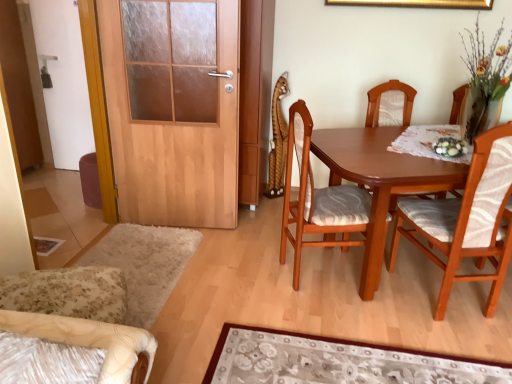
Question: Is gold metallic picture frame at upper center not within white glossy door at left?

Choices:
 (A) yes
 (B) no

Answer: (A)

Question: Considering the relative sizes of gold metallic picture frame at upper center and white glossy door at left in the image provided, is gold metallic picture frame at upper center shorter than white glossy door at left?

Choices:
 (A) yes
 (B) no

Answer: (A)

Question: Is gold metallic picture frame at upper center directly adjacent to white glossy door at left?

Choices:
 (A) no
 (B) yes

Answer: (A)

Question: From a real-world perspective, is gold metallic picture frame at upper center on top of white glossy door at left?

Choices:
 (A) no
 (B) yes

Answer: (B)

Question: Does gold metallic picture frame at upper center appear on the left side of white glossy door at left?

Choices:
 (A) no
 (B) yes

Answer: (A)

Question: Relative to wooden chair with patterned cushion at center, positioned as the third chair in right-to-left order, is wooden chair with patterned cushion at center, which is the 3th chair from left to right, in front or behind?

Choices:
 (A) front
 (B) behind

Answer: (B)

Question: In terms of width, does wooden chair with patterned cushion at center, which is the 3th chair from left to right, look wider or thinner when compared to wooden chair with patterned cushion at center, positioned as the third chair in right-to-left order?

Choices:
 (A) wide
 (B) thin

Answer: (A)

Question: Visually, is wooden chair with patterned cushion at center, which is the 3th chair from left to right, positioned to the left or to the right of wooden chair with patterned cushion at center, positioned as the third chair in right-to-left order?

Choices:
 (A) left
 (B) right

Answer: (B)

Question: Is point (372, 102) closer or farther from the camera than point (323, 240)?

Choices:
 (A) farther
 (B) closer

Answer: (A)

Question: Considering their positions, is wooden door at left located in front of or behind gold metallic picture frame at upper center?

Choices:
 (A) front
 (B) behind

Answer: (A)

Question: Is wooden door at left spatially inside gold metallic picture frame at upper center, or outside of it?

Choices:
 (A) outside
 (B) inside

Answer: (A)

Question: From a real-world perspective, is wooden door at left positioned above or below gold metallic picture frame at upper center?

Choices:
 (A) above
 (B) below

Answer: (B)

Question: Considering the positions of point click(202, 218) and point click(437, 8), is point click(202, 218) closer or farther from the camera than point click(437, 8)?

Choices:
 (A) closer
 (B) farther

Answer: (B)

Question: From a real-world perspective, is wooden chair with patterned cushion at center, which is counted as the second chair, starting from the right, physically located above or below wooden chair with patterned cushion at right, which appears as the 4th chair when viewed from the left?

Choices:
 (A) below
 (B) above

Answer: (B)

Question: From the image's perspective, relative to wooden chair with patterned cushion at right, which appears as the 4th chair when viewed from the left, is wooden chair with patterned cushion at center, which is counted as the second chair, starting from the right, above or below?

Choices:
 (A) above
 (B) below

Answer: (A)